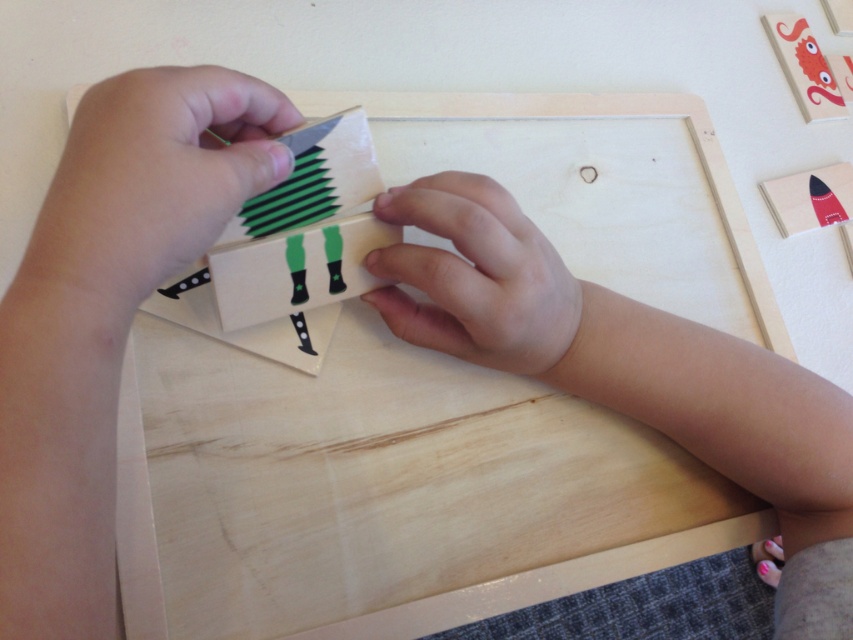
You are a craftsperson working on a wooden pencil project. You have a green matte paper at upper center and a matte red rocket at upper right on your desk. You need to place a 18 inch ruler between them. Will the ruler fit perfectly between them?

The green matte paper at upper center and matte red rocket at upper right are 19.06 inches apart from each other. Since the ruler is 18 inches long, it will fit between them with a small gap of 1.06 inches remaining.

You are organizing a craft project and need to know the order of the papers. Which paper is closer to you between the matte green paper at upper left and the green matte paper at upper center?

The matte green paper at upper left is closer to you as it is in front of the green matte paper at upper center.